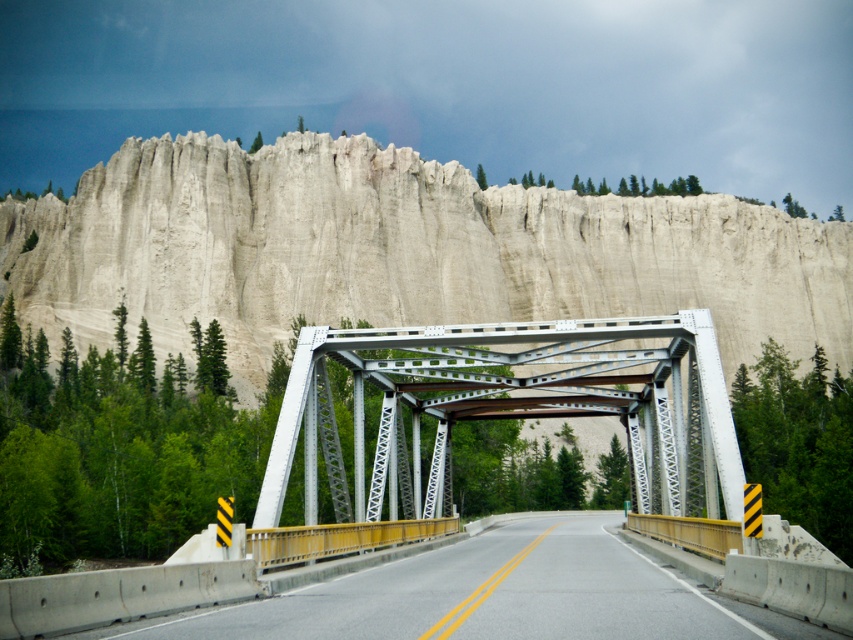
You are standing at the base of the cliff and want to take a photo of the white metallic bridge at center. If your camera has a maximum zoom range of 40 meters, will you be able to capture the entire bridge in one shot?

The white metallic bridge at center and camera are 36.64 meters apart. Since the camera can zoom up to 40 meters, which is greater than the distance of 36.64 meters, you can capture the entire bridge in one shot.

You are a delivery truck driver who needs to cross the white metallic bridge at center. However, your truck has a height of 4.5 meters. Can you safely pass under the bridge without hitting the yellow painted concrete highway at center?

The distance between the white metallic bridge at center and the yellow painted concrete highway at center is 7.31 meters. Since your truck is 4.5 meters tall, there is sufficient clearance of 2.81 meters, so you can safely pass under the bridge without hitting the highway.

Consider the image. You are a surveyor measuring distances between landmarks. You have a measuring tape that can extend up to 300 feet. You need to measure the distance between the smooth sandstone cliff at upper center and the yellow painted concrete highway at center. Can your measuring tape reach that distance?

The distance between the smooth sandstone cliff at upper center and the yellow painted concrete highway at center is 319.54 feet, which exceeds the 300 feet capacity of the measuring tape. Therefore, the tape cannot reach the full distance.